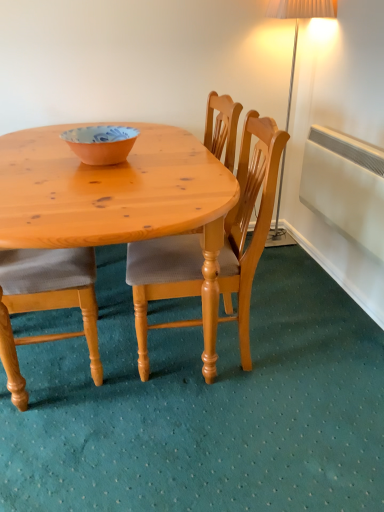
Where is `vacant region below white plastic radiator at right (from a real-world perspective)`? The image size is (384, 512). vacant region below white plastic radiator at right (from a real-world perspective) is located at coordinates (340, 282).